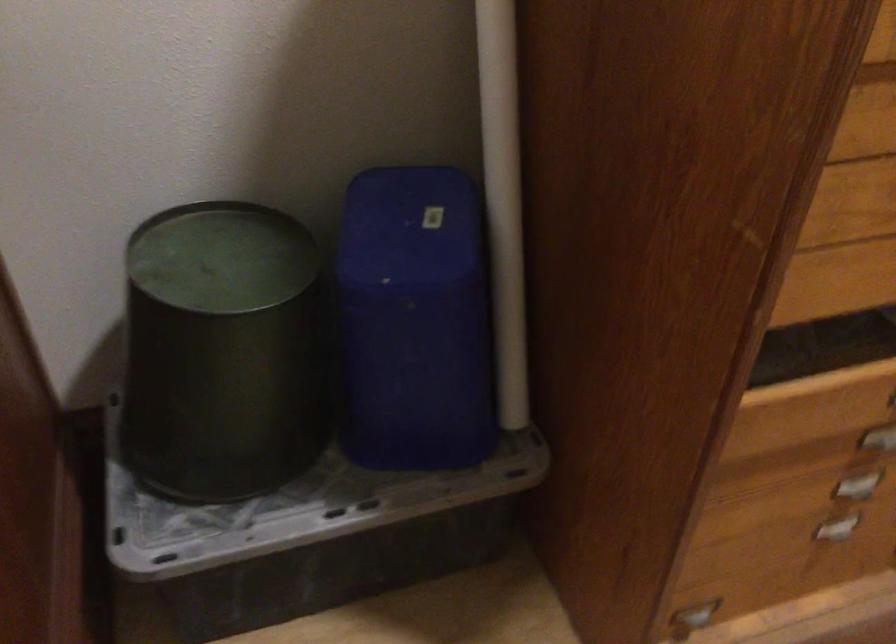
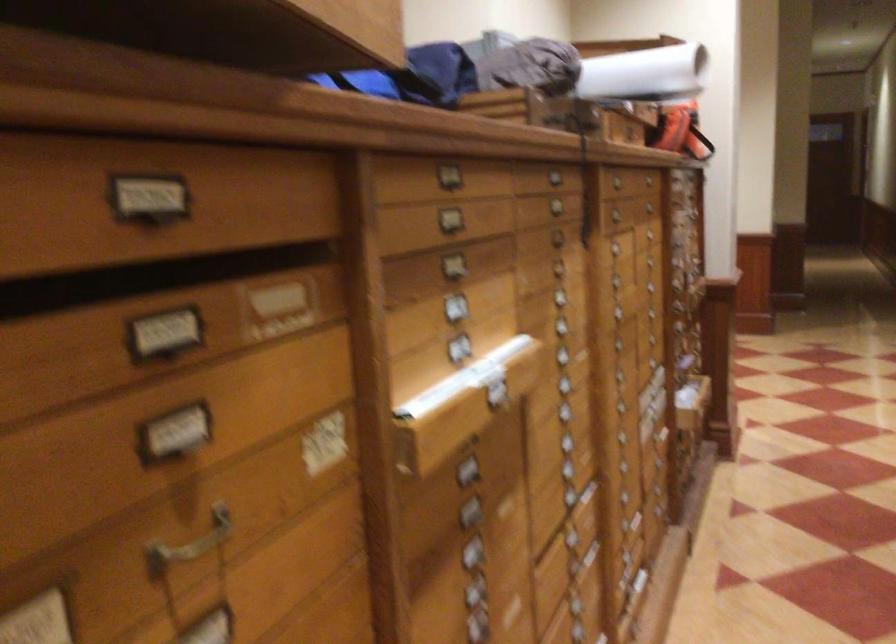
Question: How did the camera likely rotate?

Choices:
 (A) Left
 (B) Right
 (C) Up
 (D) Down

Answer: (B)